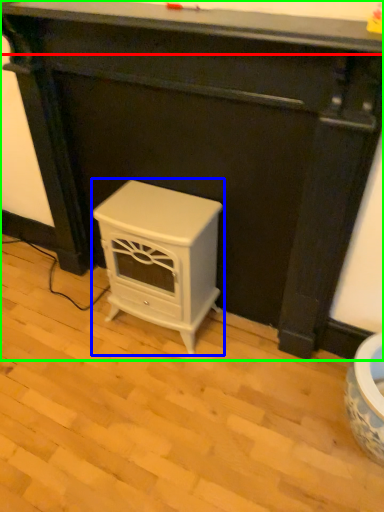
Question: Estimate the real-world distances between objects in this image. Which object is closer to counter top (highlighted by a red box), furniture (highlighted by a blue box) or furniture (highlighted by a green box)?

Choices:
 (A) furniture
 (B) furniture

Answer: (B)